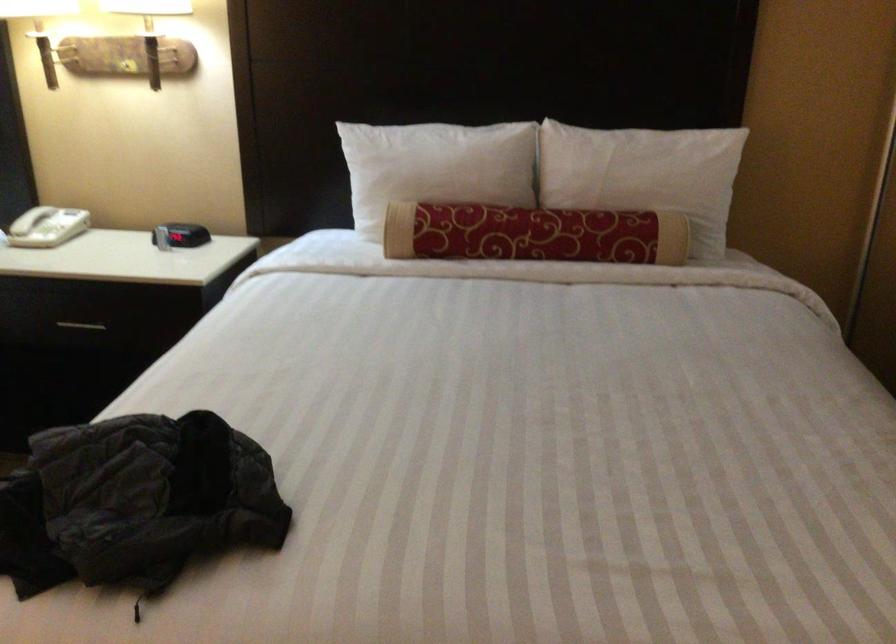
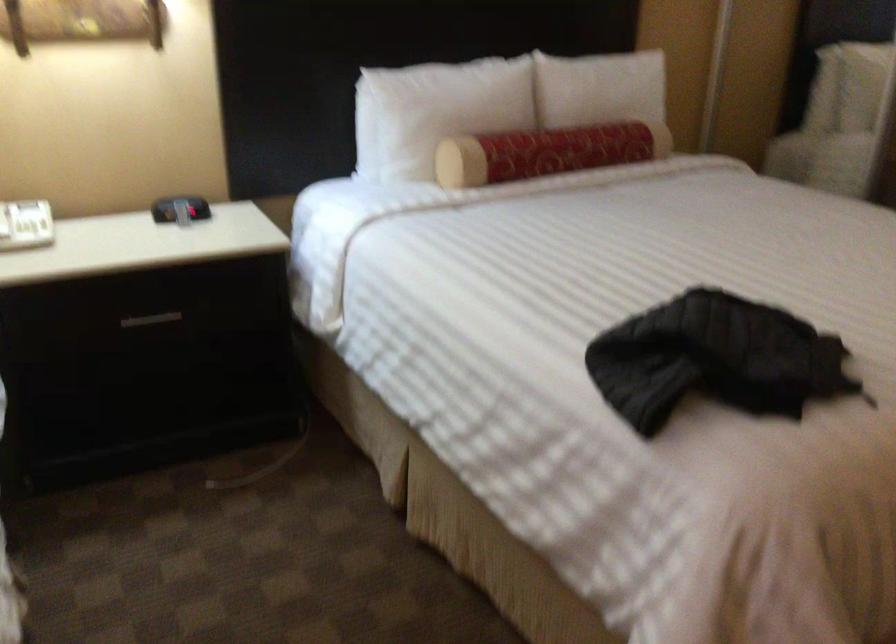
In the second image, find the point that corresponds to (492,234) in the first image.

(546, 152)